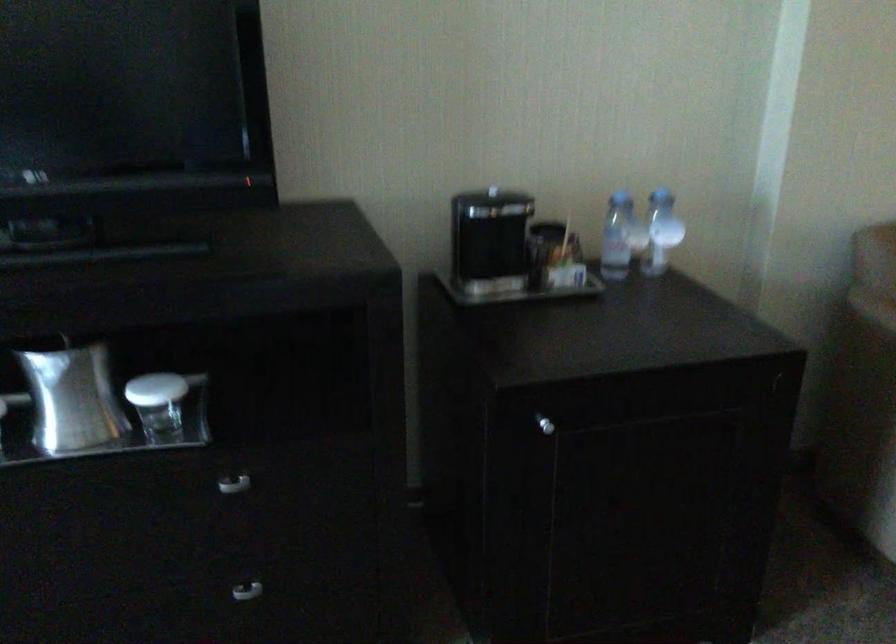
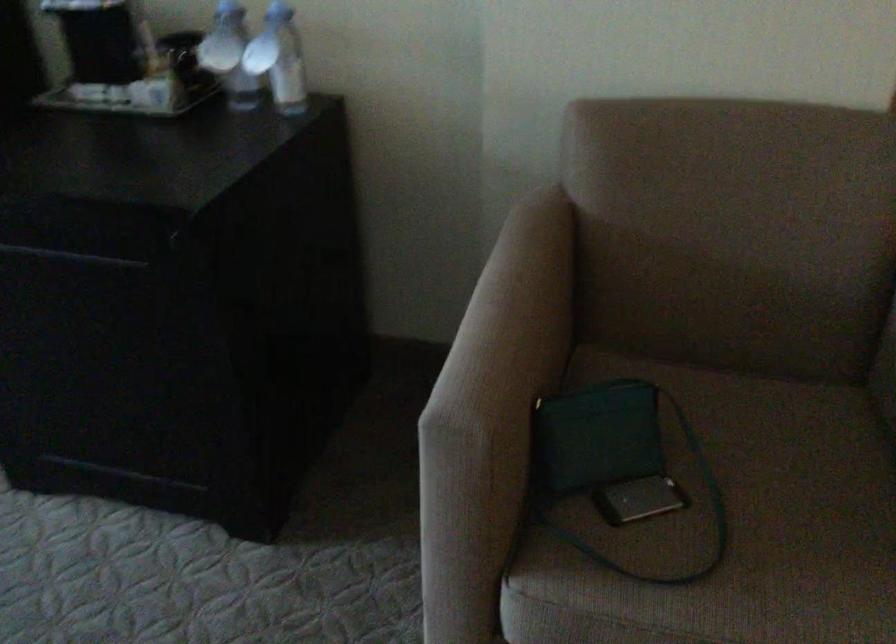
Where in the second image is the point corresponding to the point at 632,234 from the first image?

(229, 55)